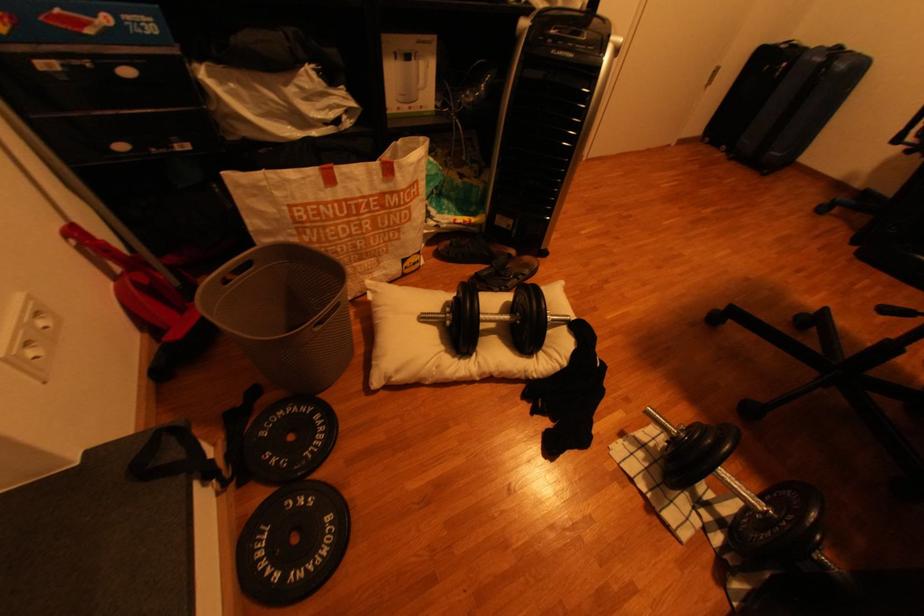
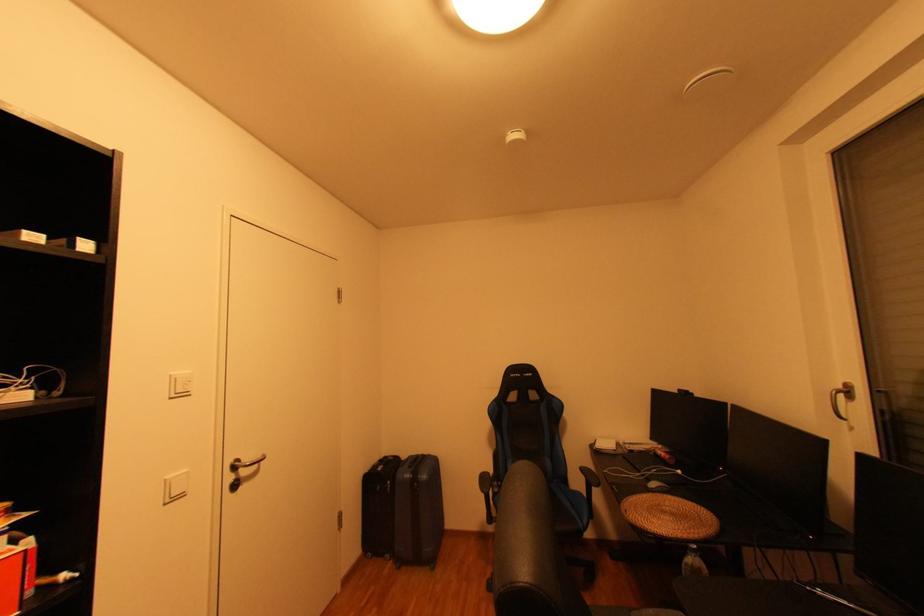
The point at (735, 154) is marked in the first image. Where is the corresponding point in the second image?

(400, 562)